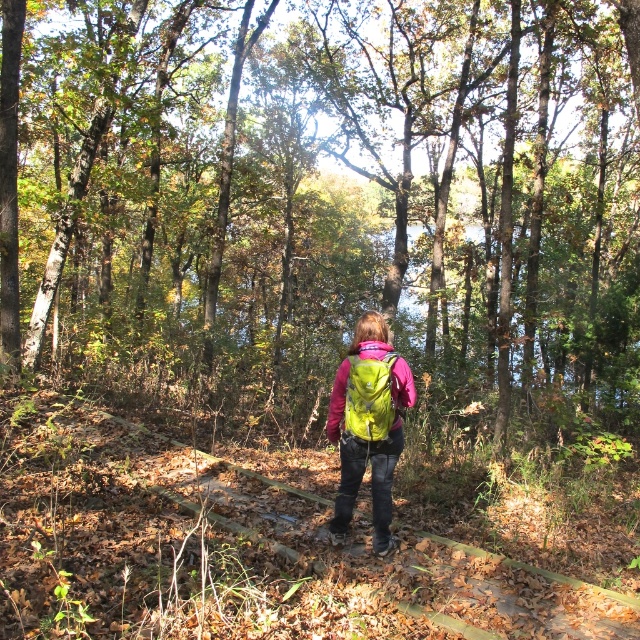
You are a hiker who wants to choose a backpack that can carry more items. You see two backpacks in the image, the neon green backpack at center and the matte green backpack at center. Which one should you choose?

The neon green backpack at center has a larger size compared to the matte green backpack at center, so you should choose the neon green backpack at center to carry more items.

You are a hiker trying to decide which backpack to take for your trip. You see a green matte backpack at center and a matte green backpack at center in the image. Which one has a bigger capacity?

The green matte backpack at center has a larger size compared to the matte green backpack at center, so it has a bigger capacity.